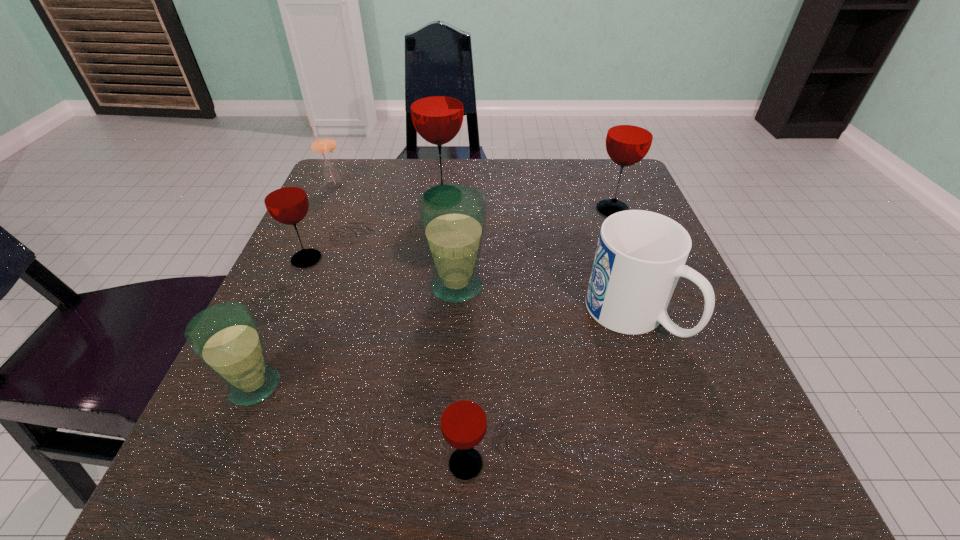
Locate an element on the screen. The width and height of the screenshot is (960, 540). the tallest object is located at coordinates (436, 102).

Locate an element on the screen. The width and height of the screenshot is (960, 540). the tallest glass is located at coordinates (436, 102).

The image size is (960, 540). Find the location of `the second tallest object`. the second tallest object is located at coordinates (629, 137).

Locate an element on the screen. This screenshot has height=540, width=960. the rightmost red glass is located at coordinates (629, 137).

Locate an element on the screen. the leftmost red glass is located at coordinates (286, 201).

Identify the location of the second smallest red glass. The image size is (960, 540). (286, 201).

What are the coordinates of `the right blue glass` in the screenshot? It's located at (453, 216).

Where is `the bigger blue glass`? the bigger blue glass is located at coordinates (453, 216).

Where is `straw`? straw is located at coordinates (323, 144).

You are a GUI agent. You are given a task and a screenshot of the screen. Output one action in this format:
    pyautogui.click(x=<x>, y=<y>)
    Task: Click on the blue mug
    This screenshot has height=540, width=960.
    Given the screenshot: What is the action you would take?
    pyautogui.click(x=640, y=255)